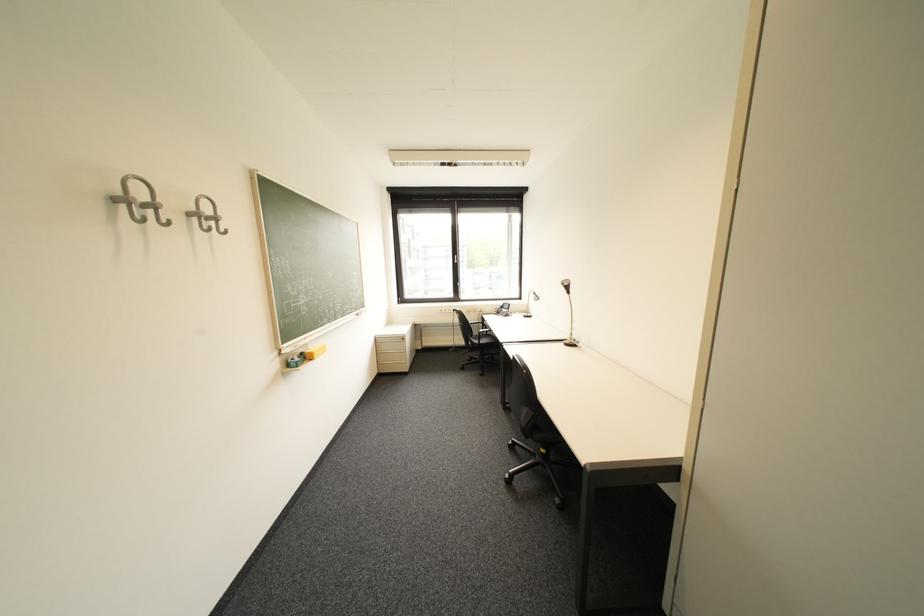
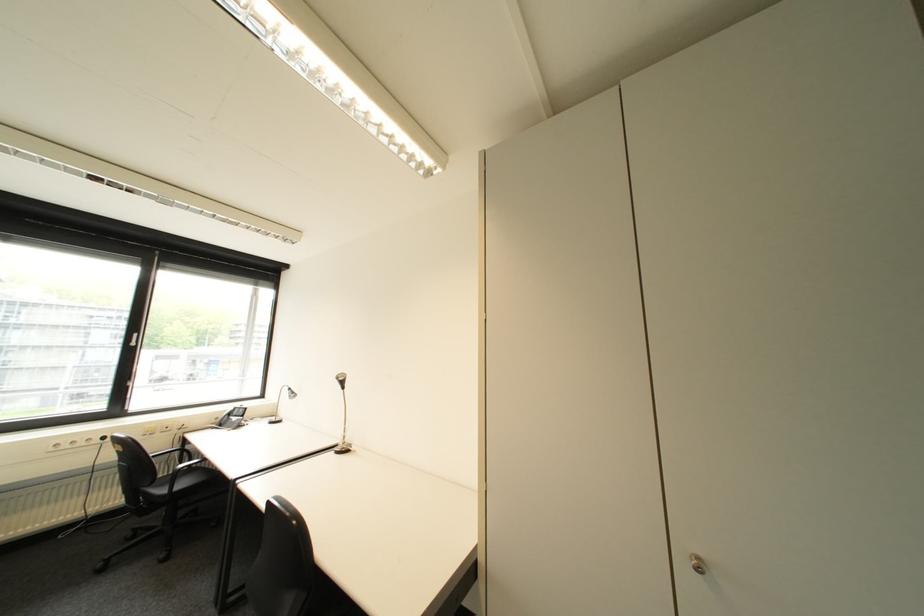
How did the camera likely rotate?

The rotation direction of the camera is right-up.